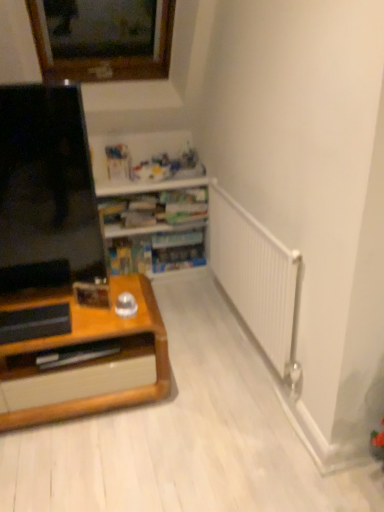
Question: From a real-world perspective, is wooden bookshelf at center located higher than black glossy screen at left?

Choices:
 (A) no
 (B) yes

Answer: (A)

Question: Would you say wooden bookshelf at center is a long distance from black glossy screen at left?

Choices:
 (A) no
 (B) yes

Answer: (A)

Question: Is wooden bookshelf at center to the left of black glossy screen at left from the viewer's perspective?

Choices:
 (A) yes
 (B) no

Answer: (B)

Question: Would you say wooden bookshelf at center contains black glossy screen at left?

Choices:
 (A) no
 (B) yes

Answer: (A)

Question: Is wooden bookshelf at center located outside black glossy screen at left?

Choices:
 (A) no
 (B) yes

Answer: (B)

Question: Is wooden bookshelf at center smaller than black glossy screen at left?

Choices:
 (A) yes
 (B) no

Answer: (B)

Question: Can you confirm if black glossy screen at left is positioned to the left of wooden bookshelf at center?

Choices:
 (A) yes
 (B) no

Answer: (A)

Question: Does black glossy screen at left turn towards wooden bookshelf at center?

Choices:
 (A) yes
 (B) no

Answer: (B)

Question: Can you confirm if black glossy screen at left is positioned to the right of wooden bookshelf at center?

Choices:
 (A) yes
 (B) no

Answer: (B)

Question: Is black glossy screen at left positioned beyond the bounds of wooden bookshelf at center?

Choices:
 (A) no
 (B) yes

Answer: (B)

Question: Does black glossy screen at left lie in front of wooden bookshelf at center?

Choices:
 (A) yes
 (B) no

Answer: (A)

Question: Is black glossy screen at left further to camera compared to wooden bookshelf at center?

Choices:
 (A) no
 (B) yes

Answer: (A)

Question: In the image, is wooden bookshelf at center on the left side or the right side of black glossy screen at left?

Choices:
 (A) left
 (B) right

Answer: (B)